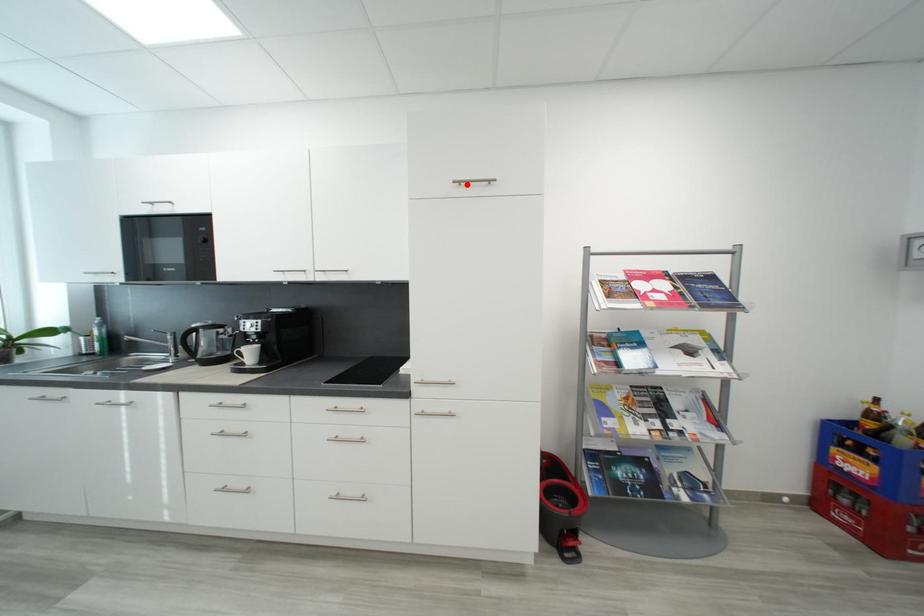
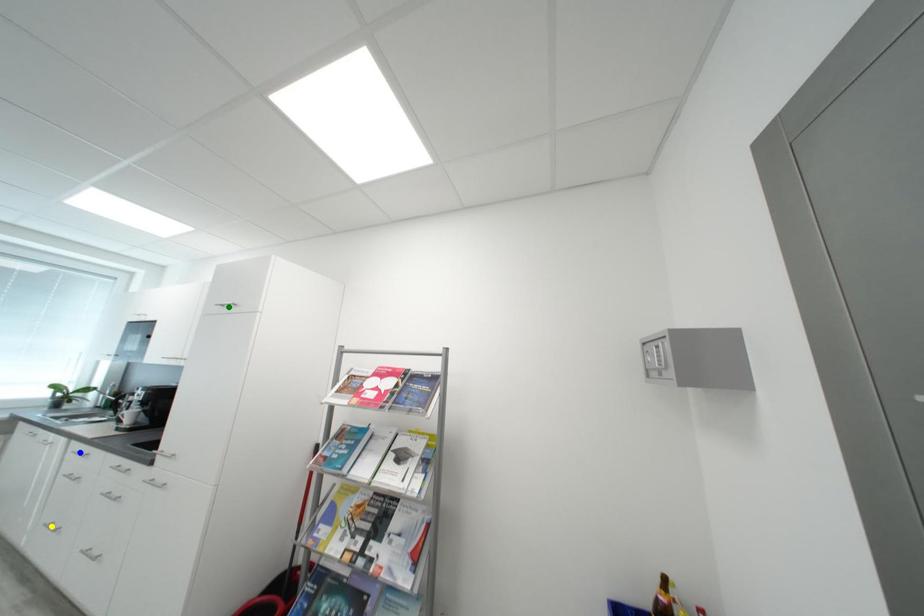
Question: I am providing you with two images of the same scene from different viewpoints. A red point is marked on the first image. You are given multiple points on the second image. In image 2, which mark is for the same physical point as the one in image 1?

Choices:
 (A) green point
 (B) yellow point
 (C) blue point

Answer: (A)